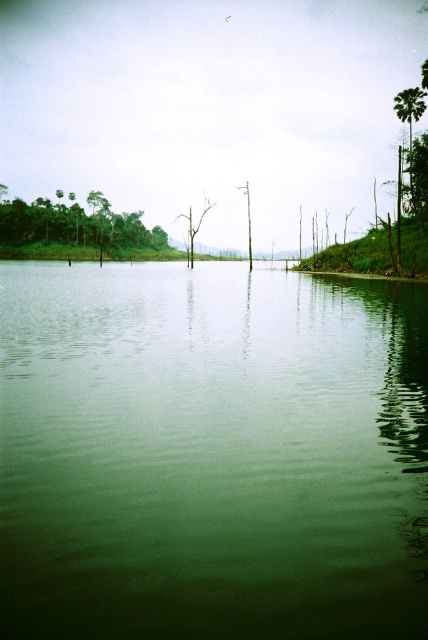
Is green smooth water at center smaller than bare wood tree at center?

Yes, green smooth water at center is smaller than bare wood tree at center.

Which is below, green smooth water at center or bare wood tree at center?

green smooth water at center

Which is in front, point (359, 628) or point (190, 259)?

Point (359, 628) is more forward.

At what (x,y) coordinates should I click in order to perform the action: click on green smooth water at center. Please return your answer as a coordinate pair (x, y). Looking at the image, I should click on (211, 454).

Between green leafy trees at upper left and bare wood tree at center, which one has less height?

With less height is green leafy trees at upper left.

Between green leafy trees at upper left and bare wood tree at center, which one appears on the left side from the viewer's perspective?

green leafy trees at upper left

Which is behind, point (136, 228) or point (193, 252)?

The point (193, 252) is behind.

This screenshot has height=640, width=428. What are the coordinates of `green leafy trees at upper left` in the screenshot? It's located at (76, 225).

Who is positioned more to the right, green smooth water at center or green leafy palm tree at upper right?

Positioned to the right is green leafy palm tree at upper right.

Can you confirm if green smooth water at center is thinner than green leafy palm tree at upper right?

No.

At what (x,y) coordinates should I click in order to perform the action: click on green smooth water at center. Please return your answer as a coordinate pair (x, y). The width and height of the screenshot is (428, 640). Looking at the image, I should click on (211, 454).

This screenshot has height=640, width=428. Identify the location of green smooth water at center. (211, 454).